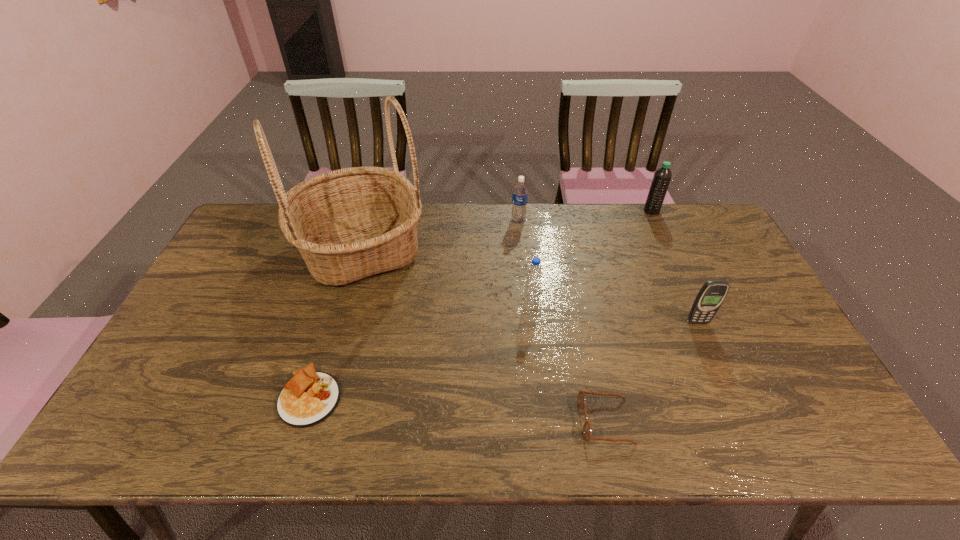
Select which water bottle is the closest to the farthest water bottle. Please provide its 2D coordinates. Your answer should be formatted as a tuple, i.e. [(x, y)], where the tuple contains the x and y coordinates of a point satisfying the conditions above.

[(520, 190)]

This screenshot has height=540, width=960. In order to click on vacant point that satisfies the following two spatial constraints: 1. on the front side of the farthest water bottle; 2. on the front-facing side of the third object from right to left in this screenshot , I will do `click(748, 421)`.

Identify the location of free space that satisfies the following two spatial constraints: 1. on the screen of the fifth farthest object; 2. on the front-facing side of the spectacles. (742, 421).

The image size is (960, 540). Identify the location of free location that satisfies the following two spatial constraints: 1. on the back side of the omelet; 2. on the right side of the farthest water bottle. (367, 211).